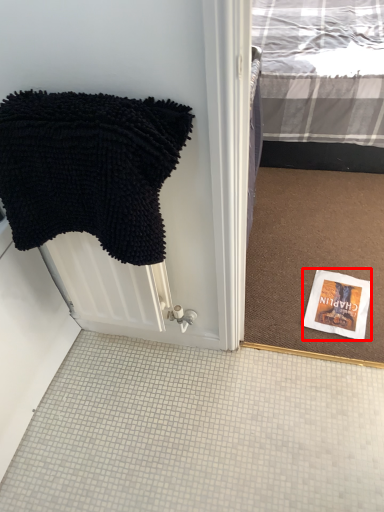
Question: From the image, what is the correct spatial relationship of book cover (annotated by the red box) in relation to towel?

Choices:
 (A) right
 (B) left

Answer: (A)